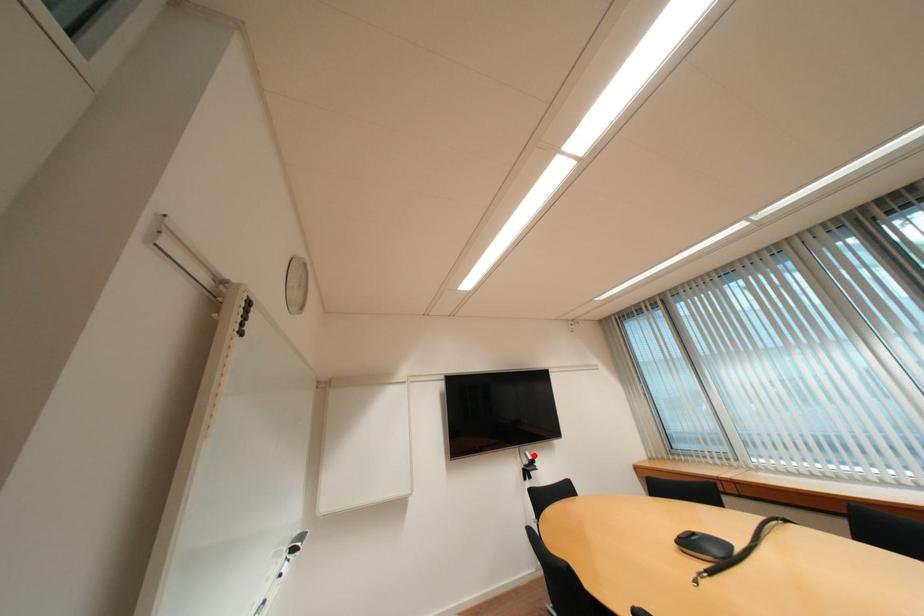
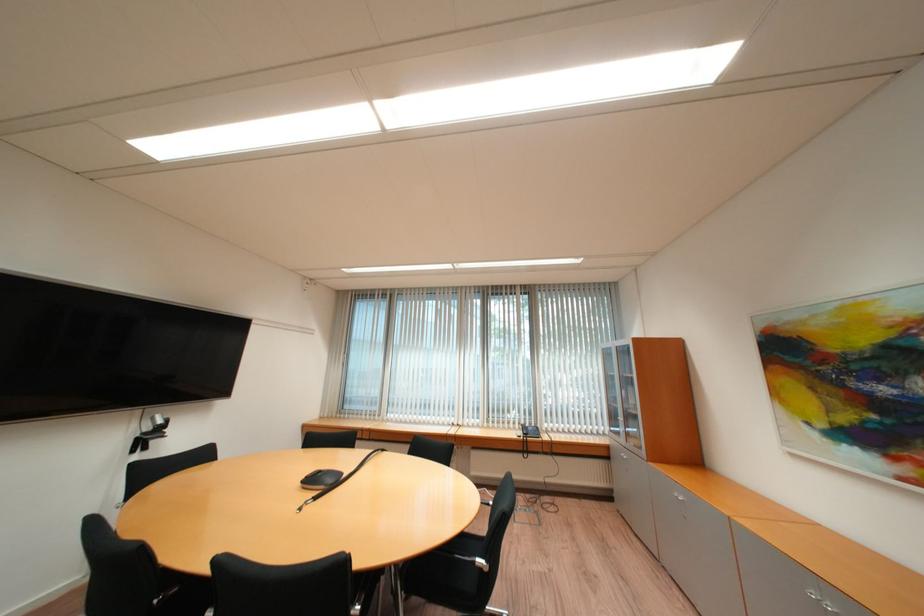
Find the pixel in the second image that matches the highlighted location in the first image.

(162, 419)